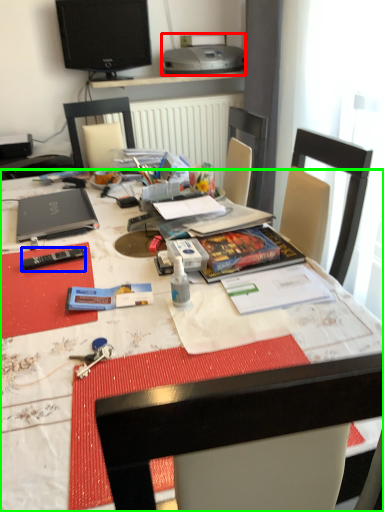
Question: Which object is positioned closest to printer (highlighted by a red box)? Select from remote control (highlighted by a blue box) and desk (highlighted by a green box).

Choices:
 (A) remote control
 (B) desk

Answer: (B)